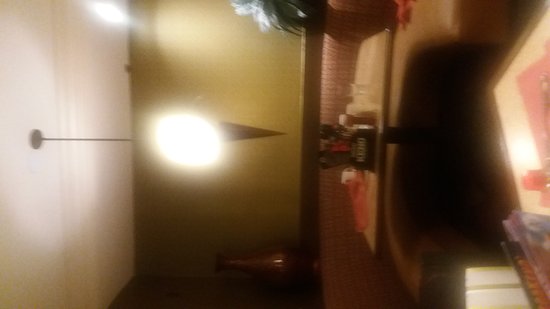
You are a GUI agent. You are given a task and a screenshot of the screen. Output one action in this format:
    pyautogui.click(x=<x>, y=<y>)
    Task: Click on the glass cup
    The image size is (550, 309).
    Given the screenshot: What is the action you would take?
    pyautogui.click(x=358, y=90)